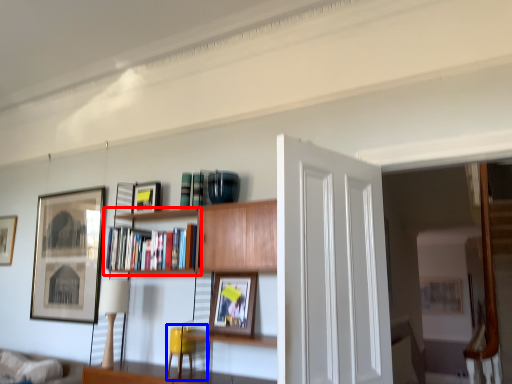
Question: Which object is further to the camera taking this photo, shelf (highlighted by a red box) or swivel chair (highlighted by a blue box)?

Choices:
 (A) shelf
 (B) swivel chair

Answer: (B)